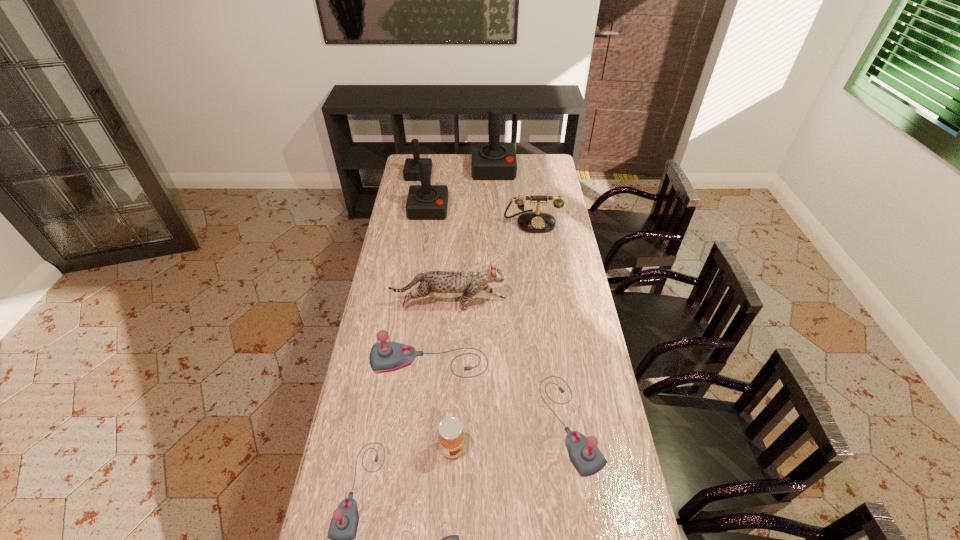
Locate an element on the screen. The image size is (960, 540). vacant space that satisfies the following two spatial constraints: 1. on the base of the rightmost gray joystick; 2. on the left side of the rightmost red joystick is located at coordinates (504, 423).